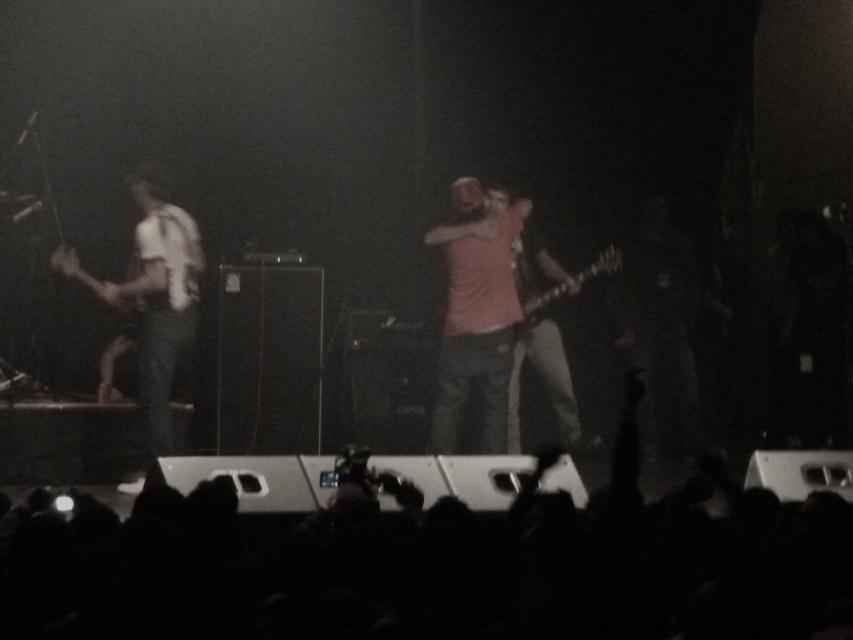
Question: Can you confirm if white matte shirt at left is positioned above shiny black electric guitar at center?

Choices:
 (A) yes
 (B) no

Answer: (B)

Question: Which point appears closest to the camera in this image?

Choices:
 (A) (151, 237)
 (B) (606, 248)

Answer: (A)

Question: Which point is closer to the camera?

Choices:
 (A) (614, 257)
 (B) (190, 305)

Answer: (B)

Question: Is white matte shirt at left below shiny black electric guitar at center?

Choices:
 (A) no
 (B) yes

Answer: (B)

Question: Can you confirm if white matte shirt at left is bigger than shiny black electric guitar at center?

Choices:
 (A) yes
 (B) no

Answer: (A)